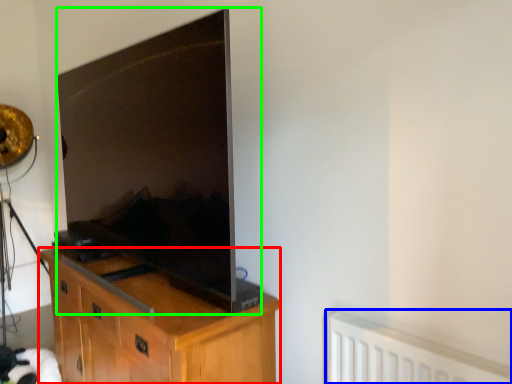
Question: Which object is positioned farthest from cabinetry (highlighted by a red box)? Select from radiator (highlighted by a blue box) and television (highlighted by a green box).

Choices:
 (A) radiator
 (B) television

Answer: (A)